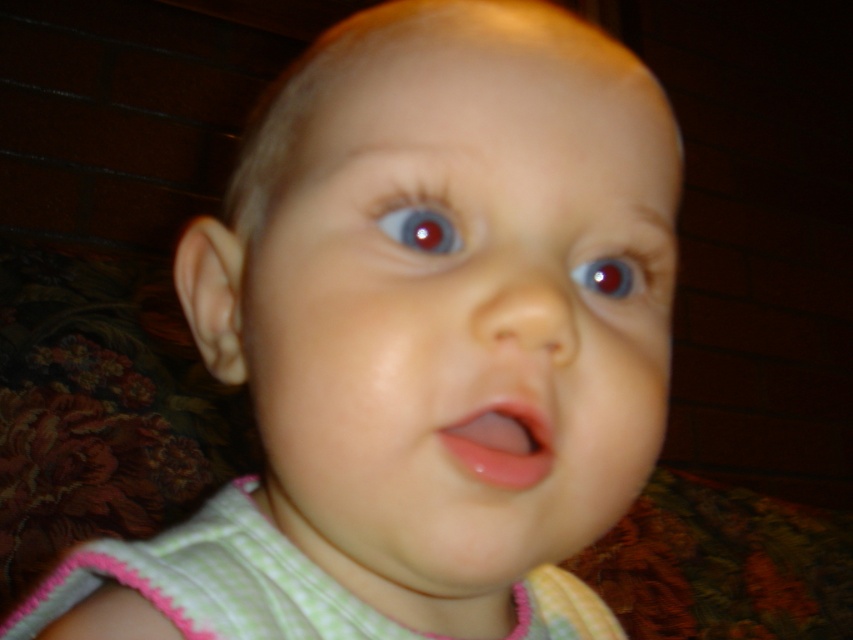
You are a photographer reviewing a baby photo. You notice two eyes in the image. The shiny blue eye at center and the glossy red eye at upper center. Which eye appears narrower in width?

The shiny blue eye at center is thinner than the glossy red eye at upper center, so the shiny blue eye at center appears narrower in width.

You are a photographer adjusting the focus of a camera. You notice the smooth skin baby at center and the shiny blue eye at center in your viewfinder. Which object should you focus on to ensure the baby is the main subject?

You should focus on the smooth skin baby at center because it is in front of the shiny blue eye at center, making it the main subject.